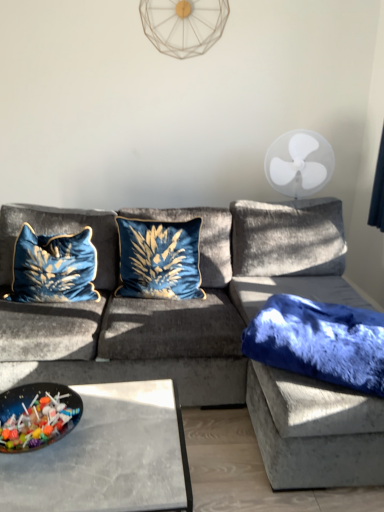
Question: Looking at their shapes, would you say velvet blue couch at center is wider or thinner than fuzzy blue blanket at right, marked as the 3th pillow in a left-to-right arrangement?

Choices:
 (A) thin
 (B) wide

Answer: (B)

Question: From the image's perspective, relative to fuzzy blue blanket at right, which ranks as the first pillow in right-to-left order, is velvet blue couch at center above or below?

Choices:
 (A) above
 (B) below

Answer: (A)

Question: Which of these objects is positioned farthest from the fuzzy blue blanket at right, marked as the 3th pillow in a left-to-right arrangement?

Choices:
 (A) glossy plastic bowl of candy at lower left
 (B) velvet blue couch at center
 (C) white plastic fan at upper right, the first mechanical fan when ordered from right to left
 (D) white plastic fan at upper center, the 2th mechanical fan positioned from the bottom
 (E) velvet blue pillow at left, which ranks as the first pillow in left-to-right order

Answer: (D)

Question: Estimate the real-world distances between objects in this image. Which object is closer to the white plastic fan at upper center, the 2th mechanical fan from the right?

Choices:
 (A) white plastic fan at upper right, acting as the first mechanical fan starting from the bottom
 (B) fuzzy blue blanket at right, which ranks as the first pillow in right-to-left order
 (C) velvet blue pillow at center, the second pillow when ordered from left to right
 (D) velvet blue pillow at left, which ranks as the first pillow in left-to-right order
 (E) glossy plastic bowl of candy at lower left

Answer: (A)